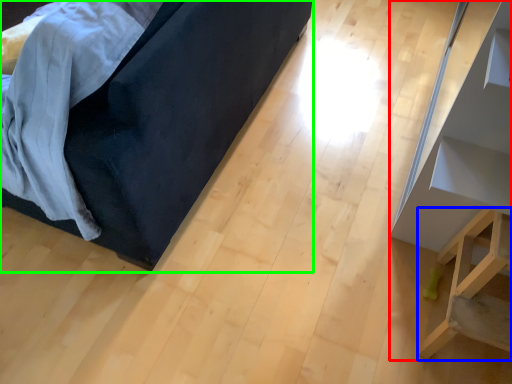
Question: Which object is positioned closest to furniture (highlighted by a red box)? Select from furniture (highlighted by a blue box) and furniture (highlighted by a green box).

Choices:
 (A) furniture
 (B) furniture

Answer: (A)